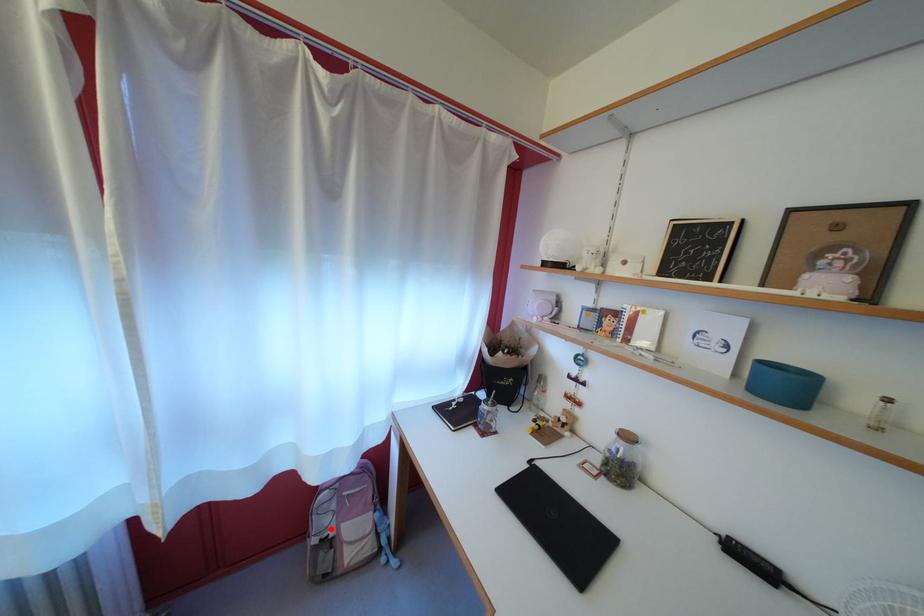
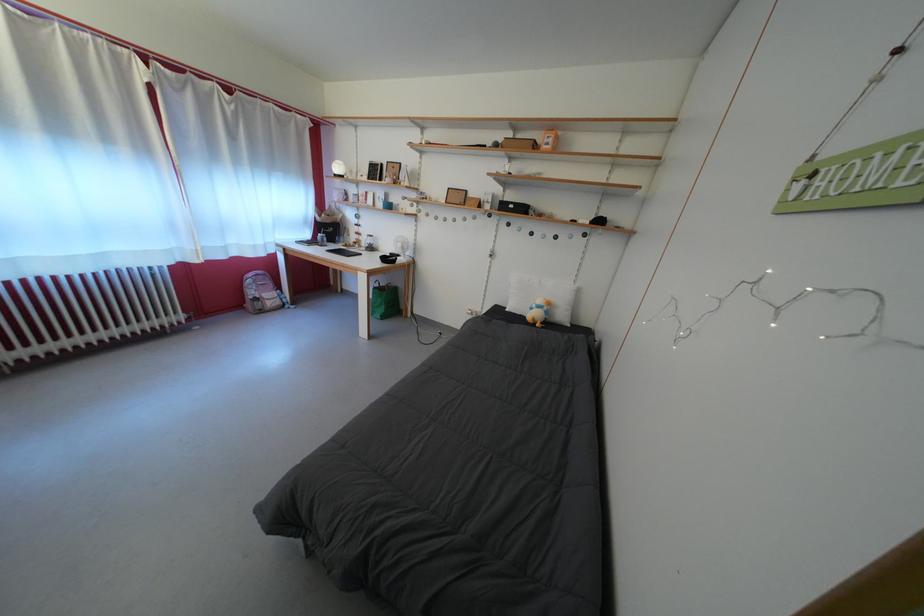
The point at the highlighted location is marked in the first image. Where is the corresponding point in the second image?

(261, 299)